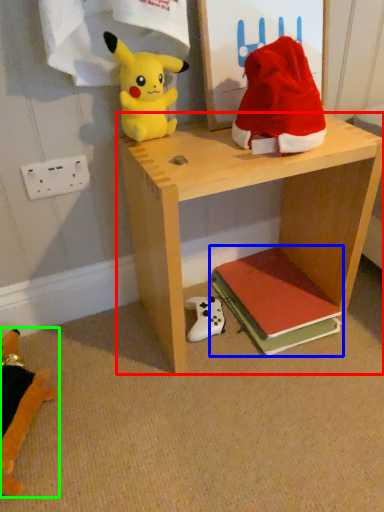
Question: Which is farther away from shelf (highlighted by a red box)? book (highlighted by a blue box) or toy (highlighted by a green box)?

Choices:
 (A) book
 (B) toy

Answer: (B)